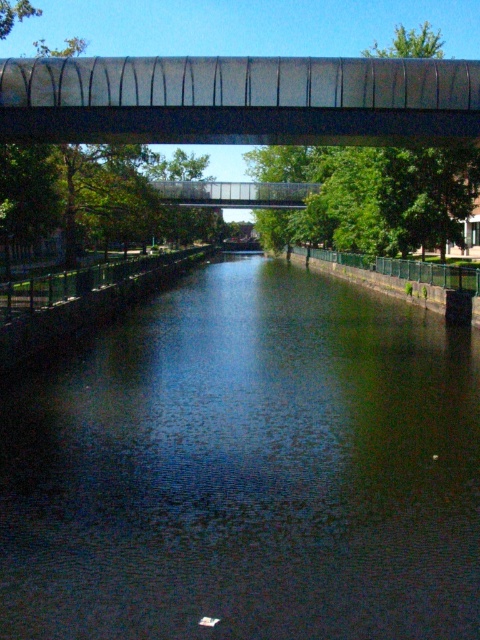
Which of these two, dark reflective water at center or transparent glass bridge at center, stands taller?

Standing taller between the two is transparent glass bridge at center.

Does dark reflective water at center appear on the right side of transparent glass bridge at center?

Indeed, dark reflective water at center is positioned on the right side of transparent glass bridge at center.

Between point (152, 547) and point (204, 184), which one is positioned behind?

The point (204, 184) is more distant.

Identify the location of dark reflective water at center. This screenshot has height=640, width=480. (247, 468).

Can you confirm if dark reflective water at center is positioned below metallic gray bridge at upper center?

Correct, dark reflective water at center is located below metallic gray bridge at upper center.

Who is taller, dark reflective water at center or metallic gray bridge at upper center?

metallic gray bridge at upper center is taller.

Is point (222, 403) more distant than point (382, 74)?

No.

This screenshot has height=640, width=480. Identify the location of dark reflective water at center. (247, 468).

Is metallic gray bridge at upper center to the left of transparent glass bridge at center from the viewer's perspective?

In fact, metallic gray bridge at upper center is to the right of transparent glass bridge at center.

Is metallic gray bridge at upper center to the right of transparent glass bridge at center from the viewer's perspective?

Correct, you'll find metallic gray bridge at upper center to the right of transparent glass bridge at center.

Locate an element on the screen. The image size is (480, 640). metallic gray bridge at upper center is located at coordinates (240, 99).